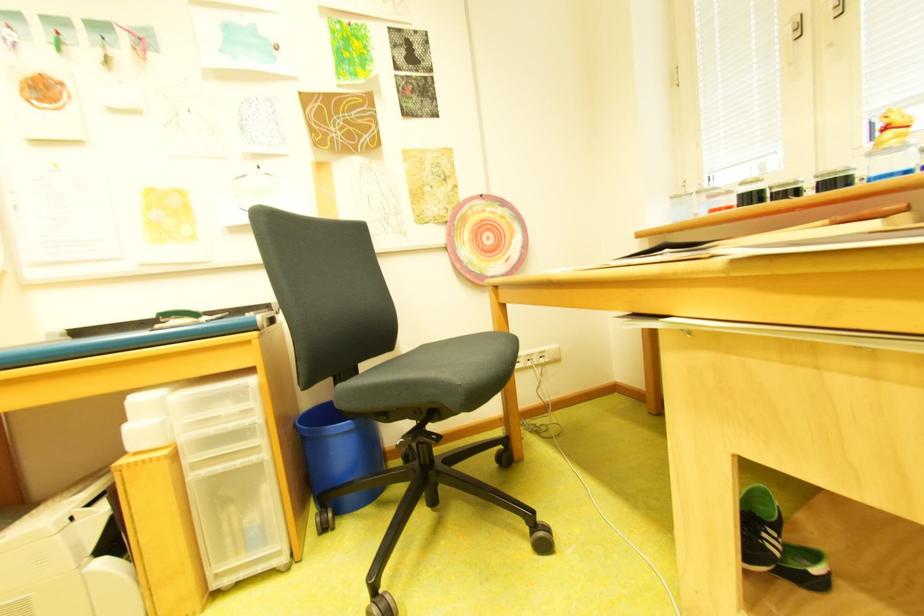
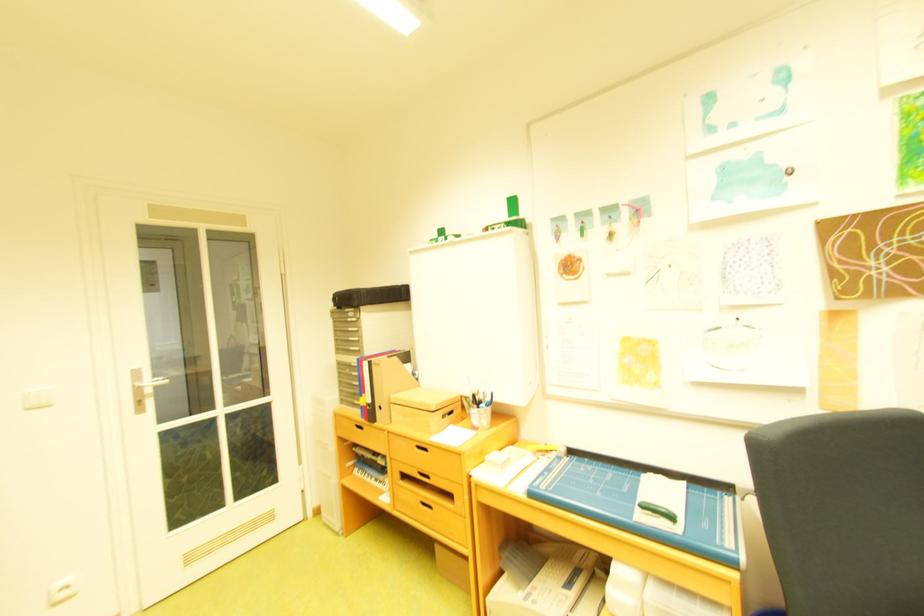
Question: How did the camera likely rotate?

Choices:
 (A) Left
 (B) Right
 (C) Up
 (D) Down

Answer: (A)